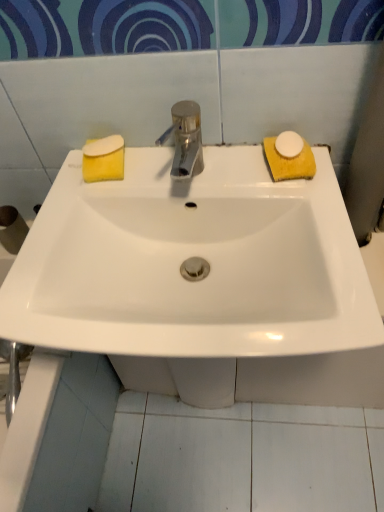
Where is `unoccupied area in front of yellow sponge at left, the 3th soap in the right-to-left sequence`? unoccupied area in front of yellow sponge at left, the 3th soap in the right-to-left sequence is located at coordinates click(x=85, y=200).